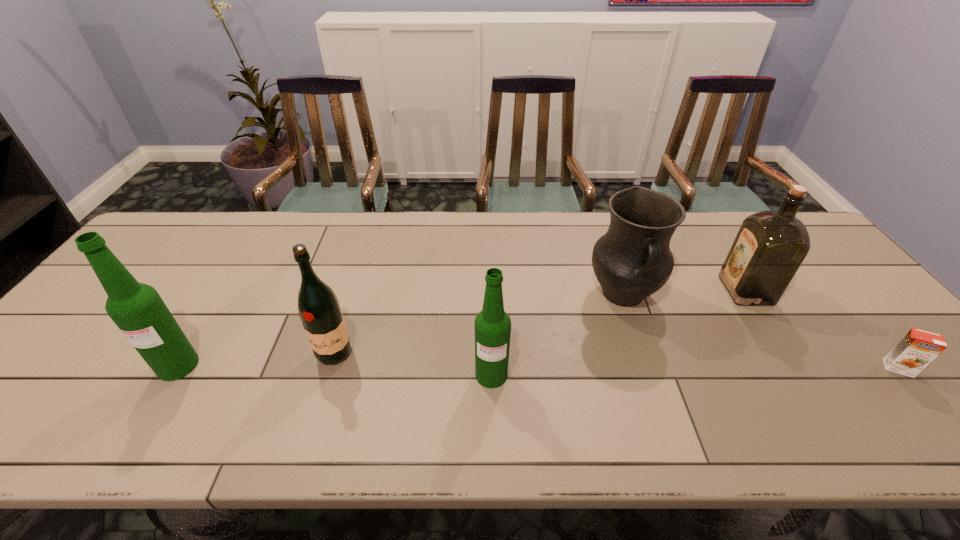
With all beer bottles evenly spaced, where should an extra beer bottle be placed on the right to continue the pattern? Please point out a vacant space. Please provide its 2D coordinates. Your answer should be formatted as a tuple, i.e. [(x, y)], where the tuple contains the x and y coordinates of a point satisfying the conditions above.

[(817, 384)]